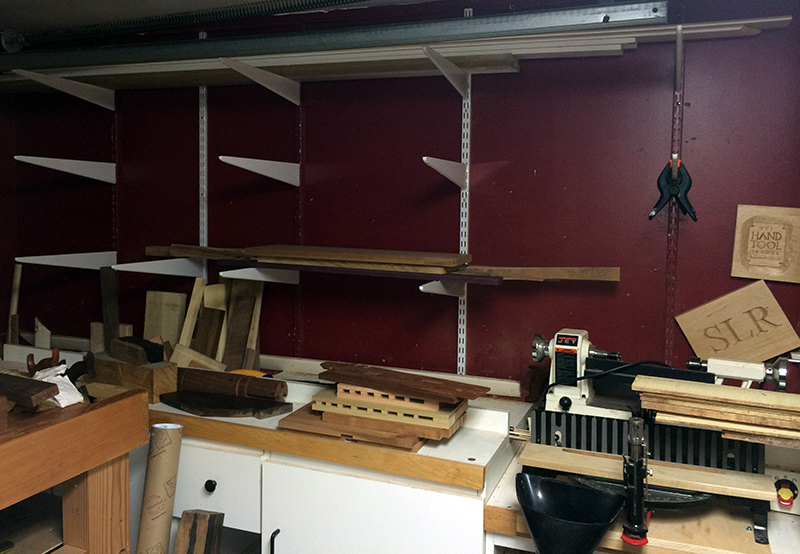
Where is `metal u handle`? The height and width of the screenshot is (554, 800). metal u handle is located at coordinates (270, 540).